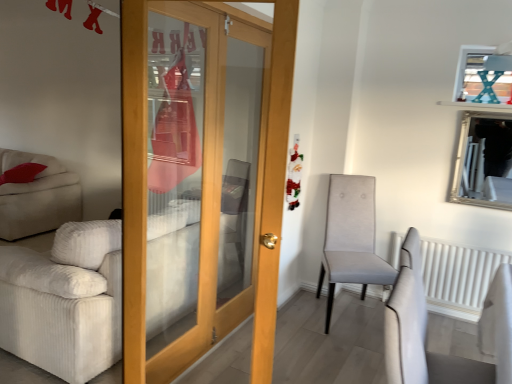
You are a GUI agent. You are given a task and a screenshot of the screen. Output one action in this format:
    pyautogui.click(x=<x>, y=<y>)
    Task: Click on the free point below silver/glass mirror at upper right (from a real-world perspective)
    
    Given the screenshot: What is the action you would take?
    pyautogui.click(x=472, y=244)